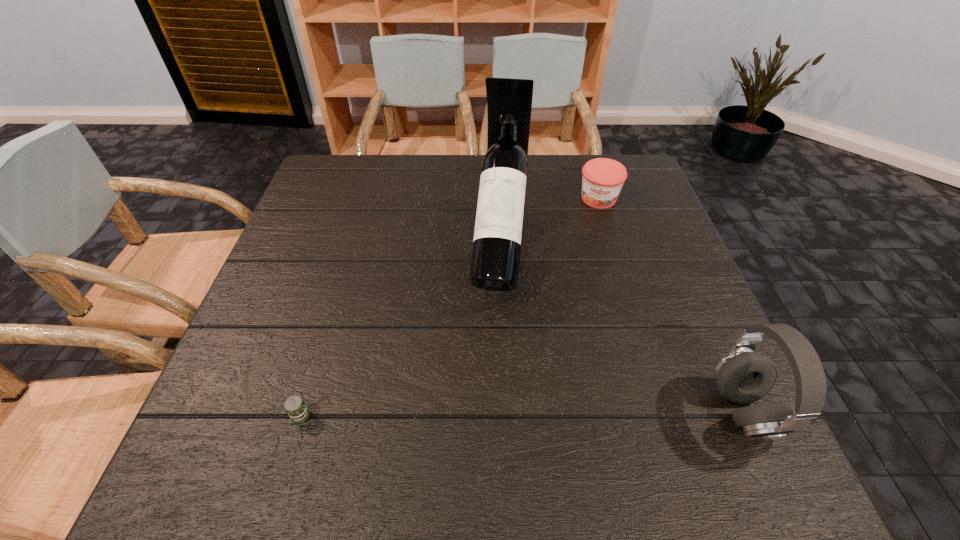
The image size is (960, 540). What are the coordinates of `free spot on the desktop that is between the leftmost object and the headset and is positioned on the front label of the second shortest object` in the screenshot? It's located at (572, 413).

At what (x,y) coordinates should I click in order to perform the action: click on free space on the desktop that is between the shortest object and the headset and is positioned on the stand of the second object from left to right. Please return your answer as a coordinate pair (x, y). The width and height of the screenshot is (960, 540). Looking at the image, I should click on (478, 414).